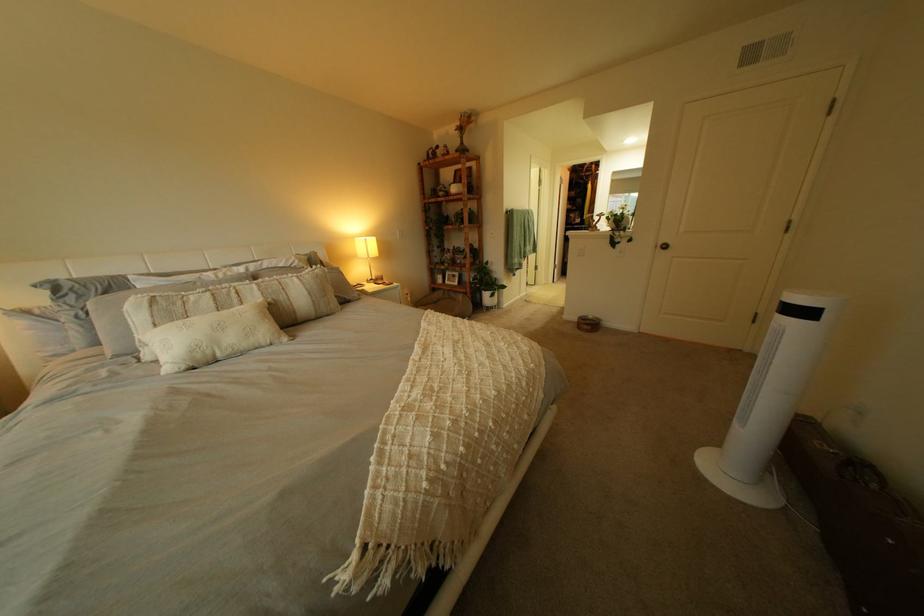
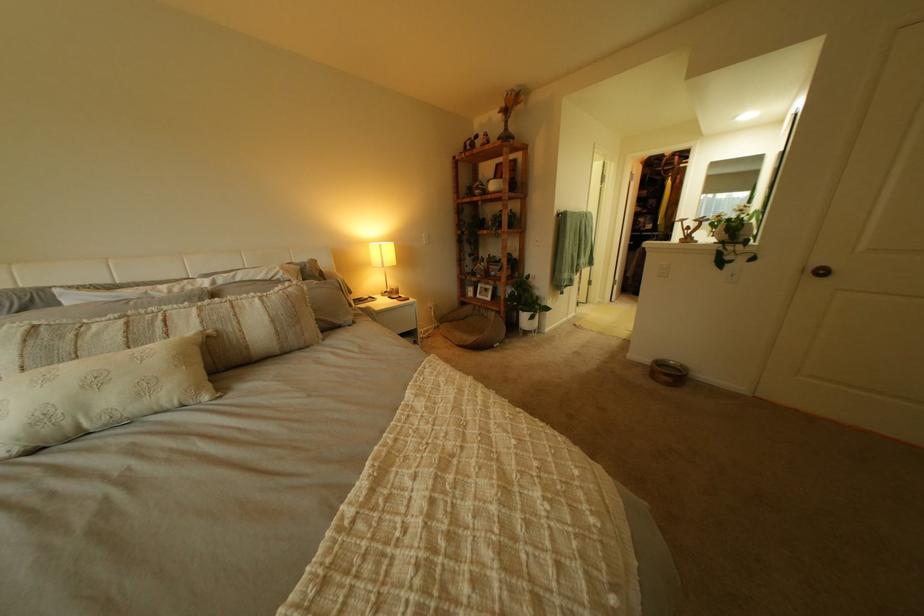
Find the pixel in the second image that matches point (368, 238) in the first image.

(381, 244)